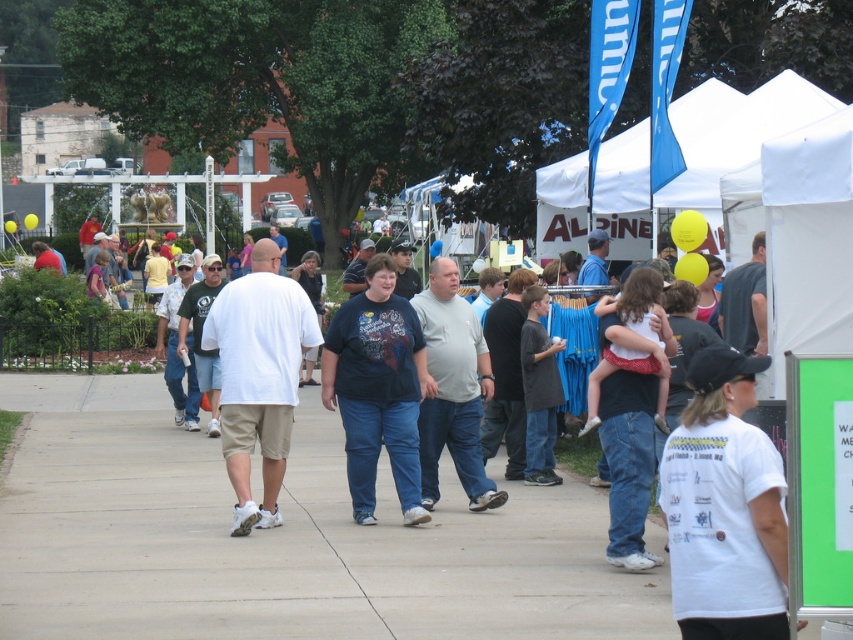
Is white t-shirt at lower right below dark gray cotton shirt at center?

Yes, white t-shirt at lower right is below dark gray cotton shirt at center.

Is white t-shirt at lower right closer to the viewer compared to dark gray cotton shirt at center?

That is True.

Who is more forward, (726,381) or (527,403)?

Point (726,381)

You are a GUI agent. You are given a task and a screenshot of the screen. Output one action in this format:
    pyautogui.click(x=<x>, y=<y>)
    Task: Click on the white t-shirt at lower right
    
    Given the screenshot: What is the action you would take?
    pyautogui.click(x=724, y=508)

Is point (480, 452) less distant than point (538, 419)?

Yes, it is in front of point (538, 419).

Is point (438, 364) positioned after point (527, 428)?

No, (438, 364) is in front of (527, 428).

The height and width of the screenshot is (640, 853). I want to click on light gray cotton shirt at center, so click(451, 388).

Is dark blue t-shirt at center behind light gray cotton shirt at center?

That is False.

Can you confirm if dark blue t-shirt at center is positioned above light gray cotton shirt at center?

Incorrect, dark blue t-shirt at center is not positioned above light gray cotton shirt at center.

You are a GUI agent. You are given a task and a screenshot of the screen. Output one action in this format:
    pyautogui.click(x=<x>, y=<y>)
    Task: Click on the dark blue t-shirt at center
    Image resolution: width=853 pixels, height=640 pixels.
    Given the screenshot: What is the action you would take?
    pyautogui.click(x=376, y=388)

This screenshot has height=640, width=853. I want to click on dark blue t-shirt at center, so click(376, 388).